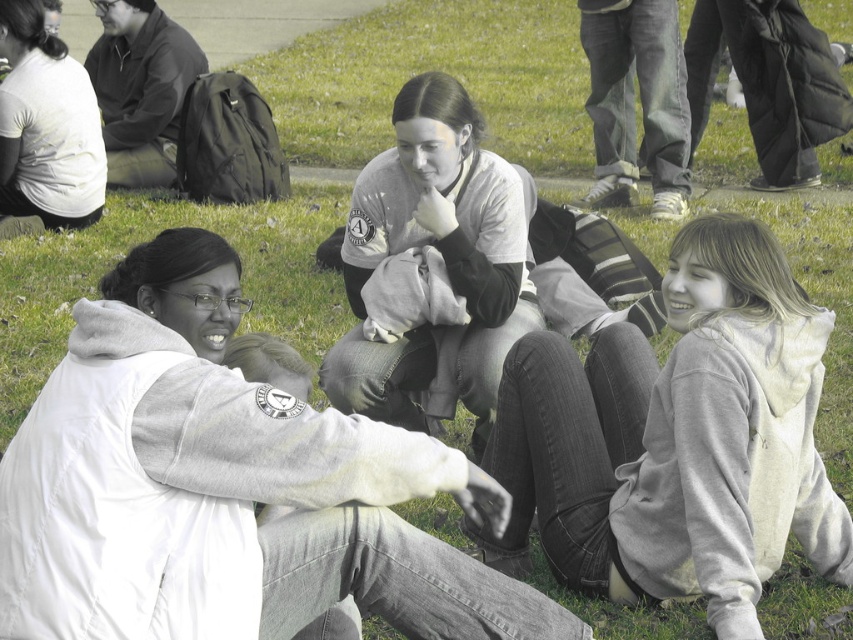
You are a photographer trying to capture a group photo of the people in the scene. You need to ensure that both the white fleece jacket at lower left and the gray cotton hoodie at lower right are clearly visible in the frame. Given their distance apart, can you fit both into a single photo without zooming in or out?

The white fleece jacket at lower left and gray cotton hoodie at lower right are 3.44 feet apart from each other. Assuming a standard camera lens with a typical field of view, this distance is manageable within a single frame without needing to zoom. Therefore, both items can be captured clearly in one photo.